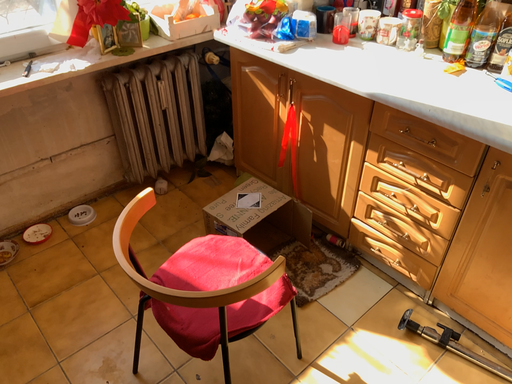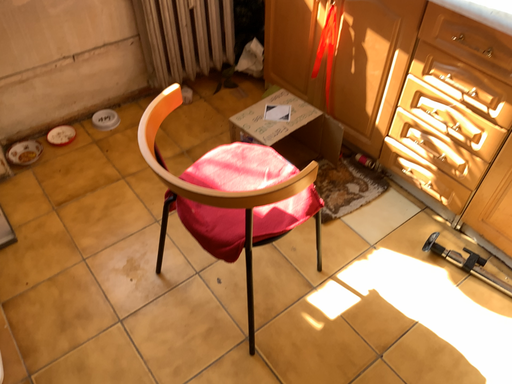
Question: How did the camera likely rotate when shooting the video?

Choices:
 (A) rotated upward
 (B) rotated downward

Answer: (B)